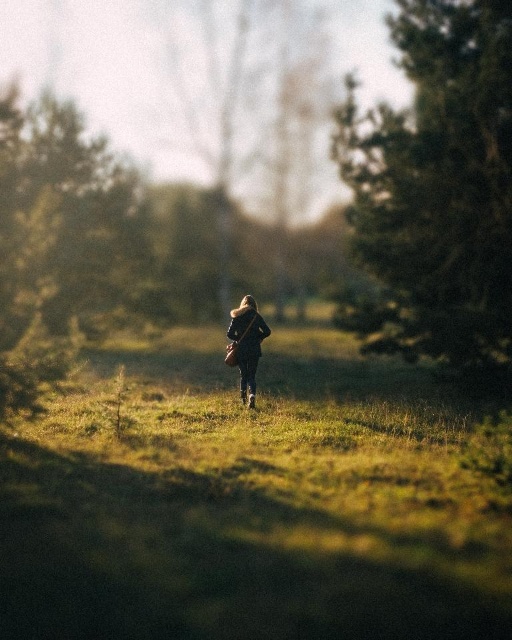
You are standing at the origin point in the image. The green textured tree at right is located at coordinates. Can you tell me its exact coordinates?

The green textured tree at right is located at coordinates (436,189).

Looking at this image, you are a hiker trying to reach the green textured tree at right from your current position. As you walk towards it, will the dark brown leather jacket at center block your path?

The green textured tree at right is in front of the dark brown leather jacket at center, meaning the tree is closer to you. Therefore, the dark brown leather jacket at center will not block your path as you walk towards the tree.